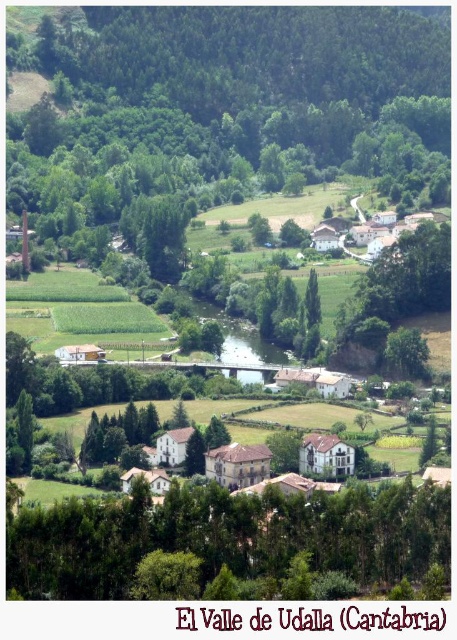
Does brown stone houses at center have a larger size compared to green leafy tree at center?

Indeed, brown stone houses at center has a larger size compared to green leafy tree at center.

This screenshot has width=457, height=640. What do you see at coordinates (283, 470) in the screenshot? I see `brown stone houses at center` at bounding box center [283, 470].

Identify the location of brown stone houses at center. This screenshot has width=457, height=640. (283, 470).

Between point (166, 524) and point (127, 492), which one is positioned behind?

The point (127, 492) is more distant.

Is point (90, 566) less distant than point (246, 477)?

Yes, it is in front of point (246, 477).

Who is more forward, (213, 528) or (311, 436)?

Point (213, 528) is more forward.

Identify the location of green leafy trees at lower center. The image size is (457, 640). (228, 536).

Who is more forward, (x=17, y=560) or (x=315, y=275)?

Positioned in front is point (x=17, y=560).

Can you confirm if green leafy trees at lower center is positioned to the right of green leafy tree at center?

In fact, green leafy trees at lower center is to the left of green leafy tree at center.

You are a GUI agent. You are given a task and a screenshot of the screen. Output one action in this format:
    pyautogui.click(x=<x>, y=<y>)
    Task: Click on the green leafy trees at lower center
    The width and height of the screenshot is (457, 640).
    Given the screenshot: What is the action you would take?
    pyautogui.click(x=228, y=536)

You are a GUI agent. You are given a task and a screenshot of the screen. Output one action in this format:
    pyautogui.click(x=<x>, y=<y>)
    Task: Click on the green leafy trees at lower center
    This screenshot has width=457, height=640.
    Given the screenshot: What is the action you would take?
    pyautogui.click(x=228, y=536)